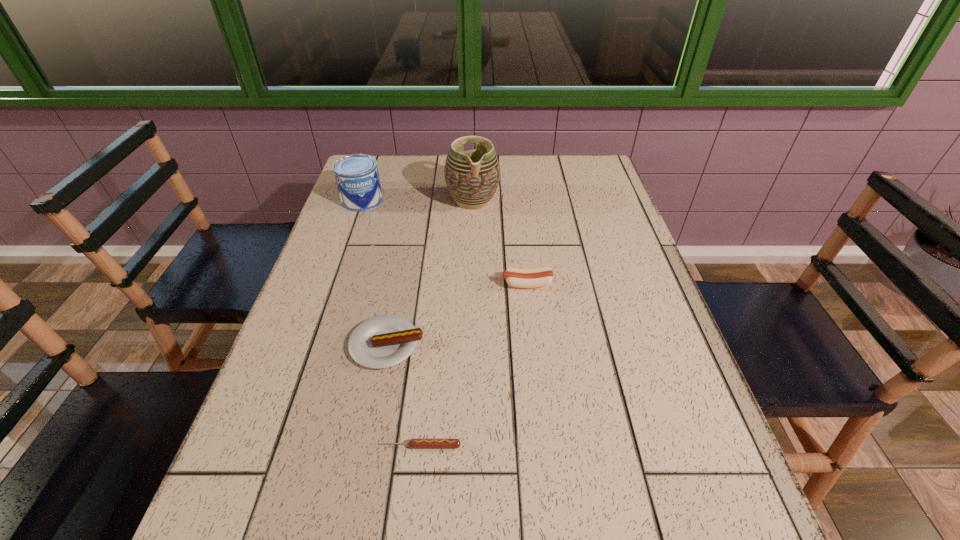
Find the location of a particular element. vacant space at the left edge of the desktop is located at coordinates (311, 335).

What are the coordinates of `vacant area at the right edge` in the screenshot? It's located at (611, 234).

Where is `vacant space at the far left corner`? The image size is (960, 540). vacant space at the far left corner is located at coordinates (396, 165).

Where is `unoccupied area between the pottery and the fourth shortest object`? The width and height of the screenshot is (960, 540). unoccupied area between the pottery and the fourth shortest object is located at coordinates (418, 200).

You are a GUI agent. You are given a task and a screenshot of the screen. Output one action in this format:
    pyautogui.click(x=<x>, y=<y>)
    Task: Click on the vacant area that lies between the tallest object and the second tallest object
    
    Given the screenshot: What is the action you would take?
    pyautogui.click(x=418, y=200)

Locate an element on the screen. vacant region between the pottery and the nearest sausage is located at coordinates (447, 323).

Identify the location of vacant area that lies between the shortest object and the pottery. This screenshot has height=540, width=960. (447, 323).

Image resolution: width=960 pixels, height=540 pixels. Identify the location of vacant point located between the nearest sausage and the third nearest object. pos(474,365).

Where is `vacant point located between the can and the pottery`? The width and height of the screenshot is (960, 540). vacant point located between the can and the pottery is located at coordinates (418, 200).

Locate an element on the screen. This screenshot has width=960, height=540. free area in between the rightmost sausage and the tallest object is located at coordinates (500, 242).